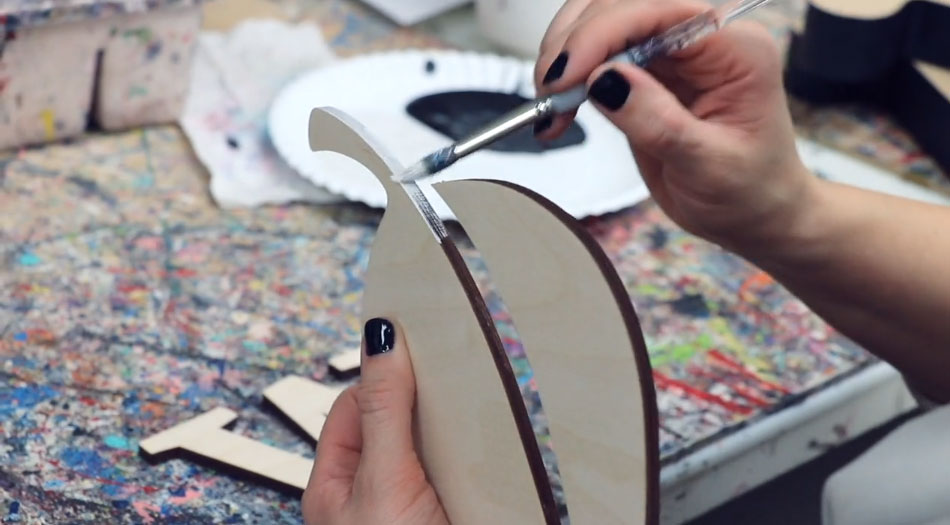
Locate an element on the screen. The width and height of the screenshot is (950, 525). paper plate is located at coordinates (408, 141).